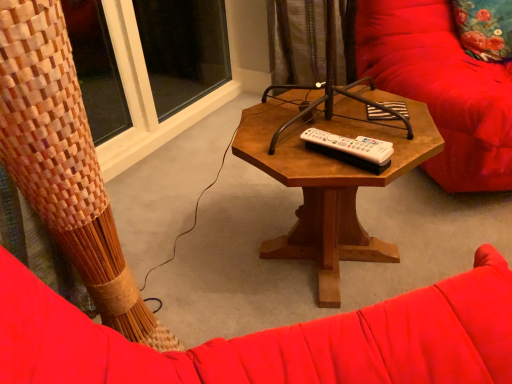
Question: Considering the relative sizes of white plastic remote at center and woven wood curtain at upper left in the image provided, is white plastic remote at center thinner than woven wood curtain at upper left?

Choices:
 (A) yes
 (B) no

Answer: (A)

Question: From a real-world perspective, does white plastic remote at center stand above woven wood curtain at upper left?

Choices:
 (A) yes
 (B) no

Answer: (A)

Question: Considering the relative sizes of white plastic remote at center and woven wood curtain at upper left in the image provided, is white plastic remote at center wider than woven wood curtain at upper left?

Choices:
 (A) no
 (B) yes

Answer: (A)

Question: From the image's perspective, does white plastic remote at center appear lower than woven wood curtain at upper left?

Choices:
 (A) yes
 (B) no

Answer: (B)

Question: Is white plastic remote at center at the right side of woven wood curtain at upper left?

Choices:
 (A) no
 (B) yes

Answer: (B)

Question: Is white plastic remote at center turned away from woven wood curtain at upper left?

Choices:
 (A) yes
 (B) no

Answer: (A)

Question: Is velvet red swivel chair at right thinner than woven wood curtain at upper left?

Choices:
 (A) no
 (B) yes

Answer: (A)

Question: From the image's perspective, is velvet red swivel chair at right under woven wood curtain at upper left?

Choices:
 (A) no
 (B) yes

Answer: (A)

Question: Is velvet red swivel chair at right smaller than woven wood curtain at upper left?

Choices:
 (A) no
 (B) yes

Answer: (A)

Question: Is velvet red swivel chair at right outside woven wood curtain at upper left?

Choices:
 (A) yes
 (B) no

Answer: (A)

Question: Is velvet red swivel chair at right looking in the opposite direction of woven wood curtain at upper left?

Choices:
 (A) yes
 (B) no

Answer: (B)

Question: From the image's perspective, is velvet red swivel chair at right on top of woven wood curtain at upper left?

Choices:
 (A) yes
 (B) no

Answer: (A)

Question: Considering the relative sizes of floral fabric pillow at upper right and velvet red swivel chair at right in the image provided, is floral fabric pillow at upper right taller than velvet red swivel chair at right?

Choices:
 (A) yes
 (B) no

Answer: (B)